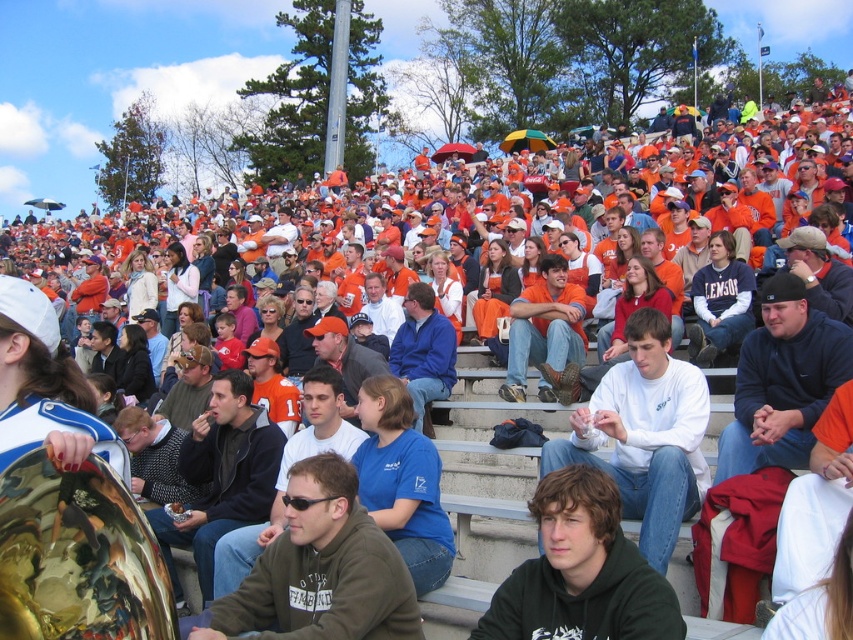
You are attending the event and want to find a seat. You see the dark gray hoodie at center and the dark green hoodie at center. Which one is closer to the ground?

The dark gray hoodie at center is closer to the ground because it is below the dark green hoodie at center.

You are a photographer trying to capture a clear shot of the dark gray hoodie at center and the dark green hoodie at center. Since you want both in focus, you need to know their sizes. Which hoodie is larger?

The dark gray hoodie at center is bigger than the dark green hoodie at center, so you should adjust your camera settings to account for the size difference to ensure both are in focus.